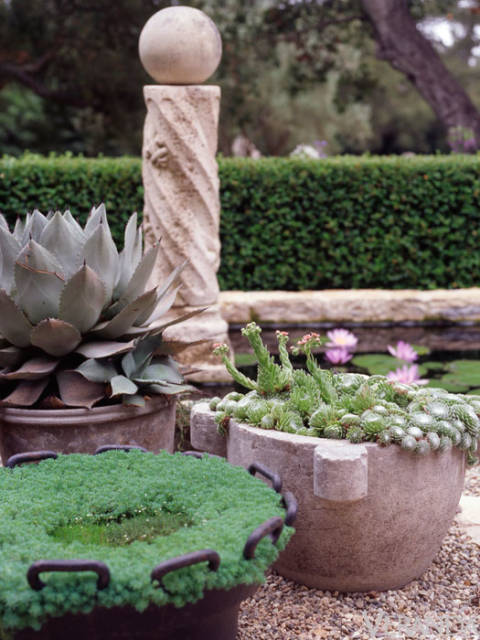
Locate an element on the screen. concrete pillar is located at coordinates (186, 225).